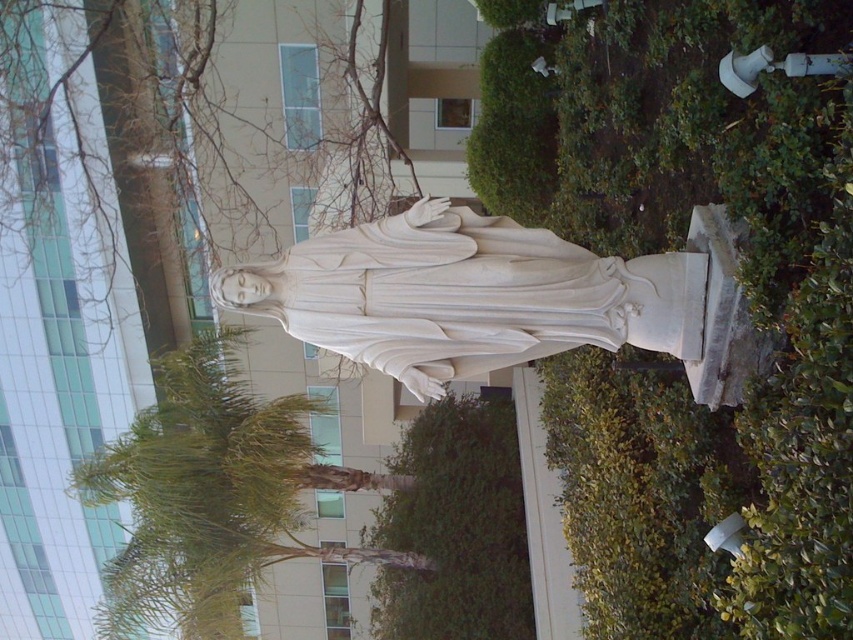
You are a landscape architect designing a garden path that needs to pass between the green leafy tree at center and the green leafy bush at lower center. Considering their sizes, which one should you place farther back to maintain a balanced visual composition?

To maintain a balanced visual composition, the green leafy bush at lower center should be placed farther back since the green leafy tree at center is larger and should be positioned closer to the viewer for visual balance.

You are an artist sketching the scene and want to draw the bare branches at upper center and the green leafy tree at center accurately. Which of these two objects is located to the left of the other?

The bare branches at upper center is positioned on the left side of green leafy tree at center.